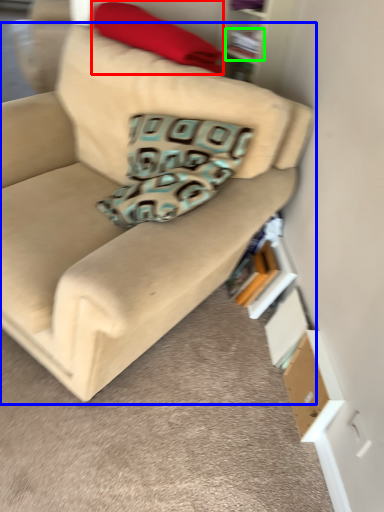
Question: Which object is positioned closest to blanket (highlighted by a red box)? Select from studio couch (highlighted by a blue box) and book (highlighted by a green box).

Choices:
 (A) studio couch
 (B) book

Answer: (B)